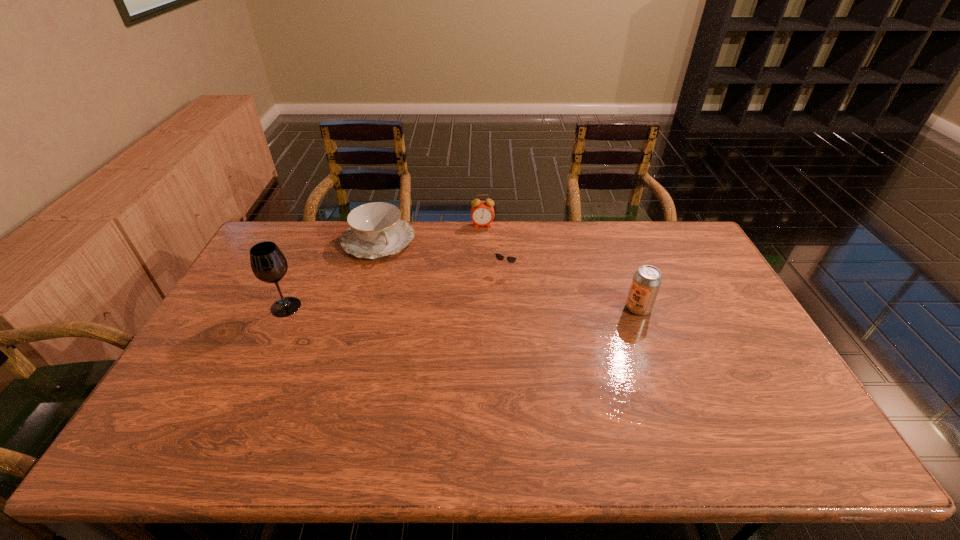
This screenshot has width=960, height=540. In order to click on free space between the second shortest object and the wineglass in this screenshot , I will do `click(332, 274)`.

You are a GUI agent. You are given a task and a screenshot of the screen. Output one action in this format:
    pyautogui.click(x=<x>, y=<y>)
    Task: Click on the vacant point located between the fourth object from right to left and the alarm clock
    
    Given the screenshot: What is the action you would take?
    pyautogui.click(x=431, y=233)

Where is `vacant area that lies between the fourth object from right to left and the shortest object`? The height and width of the screenshot is (540, 960). vacant area that lies between the fourth object from right to left and the shortest object is located at coordinates (442, 254).

Identify the location of vacant point located between the rightmost object and the chinaware. (509, 274).

You are a GUI agent. You are given a task and a screenshot of the screen. Output one action in this format:
    pyautogui.click(x=<x>, y=<y>)
    Task: Click on the free point between the chinaware and the leftmost object
    The width and height of the screenshot is (960, 540).
    Given the screenshot: What is the action you would take?
    pyautogui.click(x=332, y=274)

You are a GUI agent. You are given a task and a screenshot of the screen. Output one action in this format:
    pyautogui.click(x=<x>, y=<y>)
    Task: Click on the free space between the fourth object from right to left and the beer can
    Image resolution: width=960 pixels, height=540 pixels.
    Given the screenshot: What is the action you would take?
    pyautogui.click(x=509, y=274)

I want to click on empty location between the alarm clock and the beer can, so [561, 267].

The height and width of the screenshot is (540, 960). Find the location of `vacant area between the rightmost object and the shortest object`. vacant area between the rightmost object and the shortest object is located at coordinates (571, 288).

You are a GUI agent. You are given a task and a screenshot of the screen. Output one action in this format:
    pyautogui.click(x=<x>, y=<y>)
    Task: Click on the object that is the second nearest to the alarm clock
    
    Given the screenshot: What is the action you would take?
    pyautogui.click(x=375, y=230)

Identify the location of object that stands as the fourth closest to the sunglasses. (268, 263).